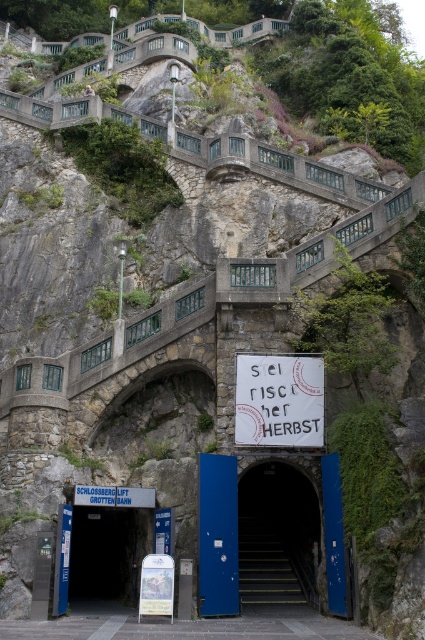
You are a hiker approaching the SCHLOSSBERGLIFT GROTTENBAHN entrance. You see the white paper sign at center and the blue metallic door at center. Which object is closer to you as you approach the entrance?

Result: The white paper sign at center is closer to you because it is further to the viewer than the blue metallic door at center, meaning it appears nearer in your line of sight.